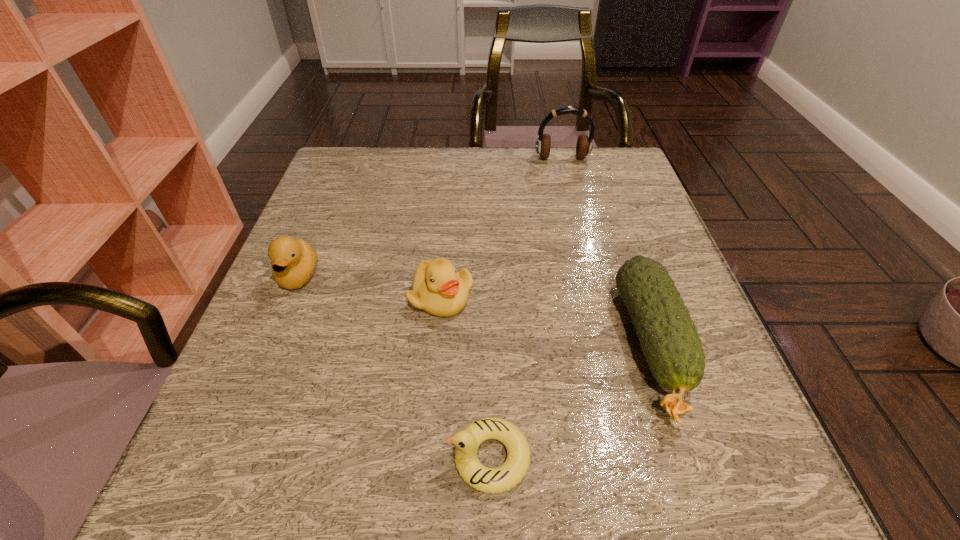
Where is `vacant space at the right edge`? This screenshot has height=540, width=960. vacant space at the right edge is located at coordinates pos(678,267).

In order to click on vacant region at the far left corner of the desktop in this screenshot , I will do `click(370, 167)`.

In the image, there is a desktop. Where is `vacant area at the far right corner`? vacant area at the far right corner is located at coordinates (619, 166).

You are a GUI agent. You are given a task and a screenshot of the screen. Output one action in this format:
    pyautogui.click(x=<x>, y=<y>)
    Task: Click on the vacant area between the leftmost object and the tallest object
    This screenshot has height=540, width=960.
    Given the screenshot: What is the action you would take?
    pyautogui.click(x=431, y=218)

The width and height of the screenshot is (960, 540). Find the location of `vacant space that is in between the cucumber and the leftmost duckling`. vacant space that is in between the cucumber and the leftmost duckling is located at coordinates (476, 311).

The width and height of the screenshot is (960, 540). I want to click on free space that is in between the nearest duckling and the cucumber, so click(x=571, y=402).

The height and width of the screenshot is (540, 960). What are the coordinates of `free space that is in between the tallest object and the leftmost object` in the screenshot? It's located at (431, 218).

Where is `vacant region between the leftmost object and the nearest duckling`? This screenshot has height=540, width=960. vacant region between the leftmost object and the nearest duckling is located at coordinates (394, 367).

At what (x,y) coordinates should I click in order to perform the action: click on free spot between the leftmost duckling and the shortest duckling. Please return your answer as a coordinate pair (x, y). Looking at the image, I should click on (394, 367).

Where is `free spot between the tallest object and the leftmost duckling`? This screenshot has height=540, width=960. free spot between the tallest object and the leftmost duckling is located at coordinates (431, 218).